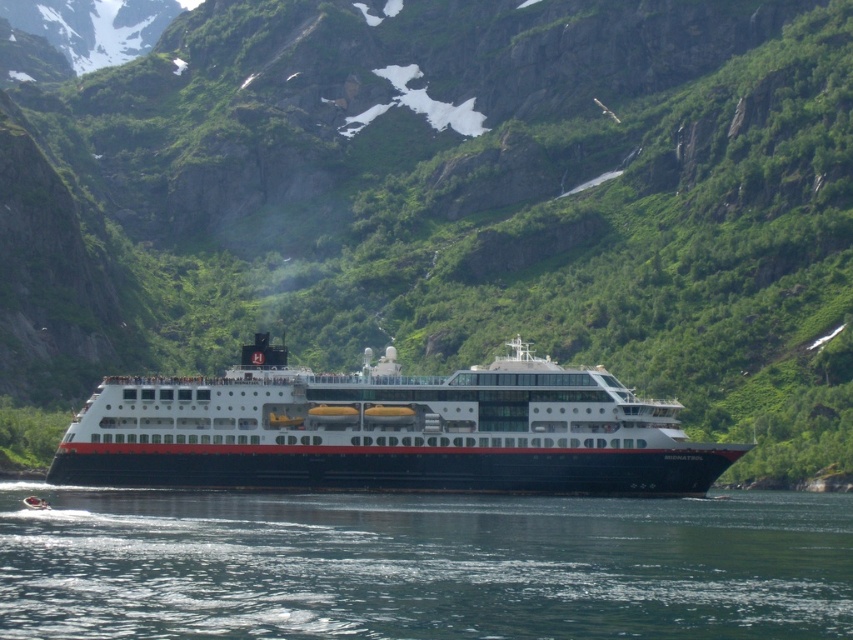
Question: Which point is closer to the camera taking this photo?

Choices:
 (A) (497, 506)
 (B) (744, 449)

Answer: (A)

Question: Is clear blue water at lower center to the left of white glossy cruise ship at center from the viewer's perspective?

Choices:
 (A) no
 (B) yes

Answer: (B)

Question: Can you confirm if clear blue water at lower center is thinner than white glossy cruise ship at center?

Choices:
 (A) yes
 (B) no

Answer: (B)

Question: In this image, where is clear blue water at lower center located relative to white glossy cruise ship at center?

Choices:
 (A) left
 (B) right

Answer: (A)

Question: Among these points, which one is farthest from the camera?

Choices:
 (A) (503, 403)
 (B) (733, 541)

Answer: (A)